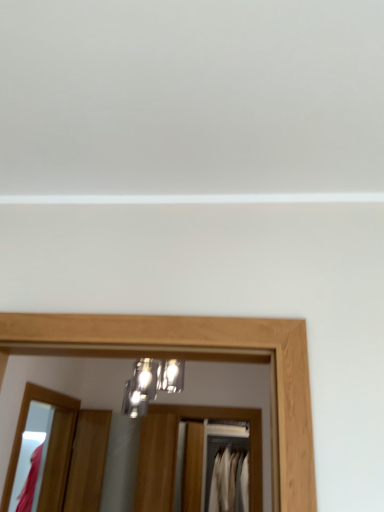
Question: Is matte wooden mirror at lower left positioned before wooden door at lower left?

Choices:
 (A) no
 (B) yes

Answer: (B)

Question: Is matte wooden mirror at lower left facing towards wooden door at lower left?

Choices:
 (A) yes
 (B) no

Answer: (A)

Question: Considering the relative sizes of matte wooden mirror at lower left and wooden door at lower left in the image provided, is matte wooden mirror at lower left bigger than wooden door at lower left?

Choices:
 (A) yes
 (B) no

Answer: (A)

Question: Is matte wooden mirror at lower left taller than wooden door at lower left?

Choices:
 (A) yes
 (B) no

Answer: (A)

Question: Is matte wooden mirror at lower left to the right of wooden door at lower left from the viewer's perspective?

Choices:
 (A) yes
 (B) no

Answer: (B)

Question: In terms of size, does white fabric at center, marked as the first clothing in a back-to-front arrangement, appear bigger or smaller than matte wooden mirror at lower left?

Choices:
 (A) small
 (B) big

Answer: (A)

Question: Choose the correct answer: Is white fabric at center, marked as the first clothing in a back-to-front arrangement, inside matte wooden mirror at lower left or outside it?

Choices:
 (A) inside
 (B) outside

Answer: (B)

Question: Considering the positions of point (238, 471) and point (69, 438), is point (238, 471) closer or farther from the camera than point (69, 438)?

Choices:
 (A) closer
 (B) farther

Answer: (B)

Question: From the image's perspective, relative to matte wooden mirror at lower left, is white fabric at center, marked as the first clothing in a back-to-front arrangement, above or below?

Choices:
 (A) below
 (B) above

Answer: (A)

Question: From a real-world perspective, is matte wooden mirror at lower left positioned above or below wooden door at lower left?

Choices:
 (A) below
 (B) above

Answer: (B)

Question: From the image's perspective, relative to wooden door at lower left, is matte wooden mirror at lower left above or below?

Choices:
 (A) below
 (B) above

Answer: (B)

Question: Would you say matte wooden mirror at lower left is inside or outside wooden door at lower left?

Choices:
 (A) outside
 (B) inside

Answer: (A)

Question: Relative to wooden door at lower left, is matte wooden mirror at lower left in front or behind?

Choices:
 (A) front
 (B) behind

Answer: (A)

Question: Which is correct: matte wooden mirror at lower left is inside metallic glass light fixture at center, or outside of it?

Choices:
 (A) outside
 (B) inside

Answer: (A)

Question: Is point (3, 501) closer or farther from the camera than point (137, 389)?

Choices:
 (A) farther
 (B) closer

Answer: (A)